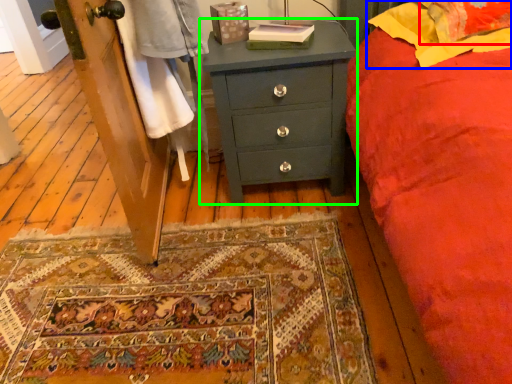
Question: Estimate the real-world distances between objects in this image. Which object is farther from pillow (highlighted by a red box), pillow (highlighted by a blue box) or chest of drawers (highlighted by a green box)?

Choices:
 (A) pillow
 (B) chest of drawers

Answer: (B)